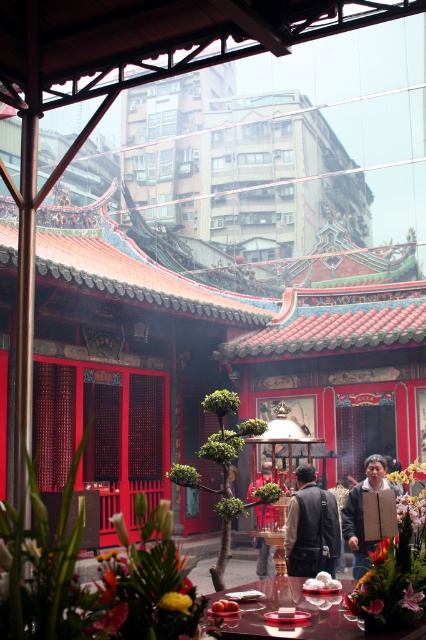
Which is behind, point (259, 476) or point (92, 634)?

The point (259, 476) is more distant.

Does dark brown leather jacket at center appear under matte pink flower at lower left?

Yes.

Is point (250, 496) positioned in front of point (109, 611)?

No, it is not.

At what (x,y) coordinates should I click in order to perform the action: click on dark brown leather jacket at center. Please return your answer as a coordinate pair (x, y). Looking at the image, I should click on (264, 557).

Who is shorter, brown fuzzy jacket at center or smooth orange fruit at center?

smooth orange fruit at center is shorter.

Can you confirm if brown fuzzy jacket at center is wider than smooth orange fruit at center?

Correct, the width of brown fuzzy jacket at center exceeds that of smooth orange fruit at center.

The image size is (426, 640). What are the coordinates of `brown fuzzy jacket at center` in the screenshot? It's located at (362, 513).

Where is `brown fuzzy jacket at center`? brown fuzzy jacket at center is located at coordinates (362, 513).

Consider the image. Between yellow matte flower at center and pink silky flower at center, which one is positioned higher?

Positioned higher is yellow matte flower at center.

Does yellow matte flower at center lie in front of pink silky flower at center?

Yes, it is.

Which is behind, point (167, 596) or point (408, 600)?

Positioned behind is point (408, 600).

Find the location of a particular element. Image resolution: width=426 pixels, height=640 pixels. yellow matte flower at center is located at coordinates (175, 602).